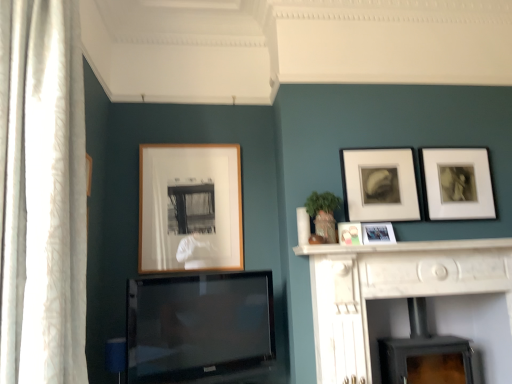
The height and width of the screenshot is (384, 512). What do you see at coordinates (350, 233) in the screenshot? I see `matte plastic picture frame at upper center, the 4th picture frame viewed from the right` at bounding box center [350, 233].

Measure the distance between point (376, 227) and camera.

The depth of point (376, 227) is 2.79 meters.

This screenshot has width=512, height=384. Describe the element at coordinates (378, 233) in the screenshot. I see `metallic silver photo frame at center-right, positioned as the 3th picture frame in left-to-right order` at that location.

Measure the distance between white sheer curtain at left and camera.

4.76 feet.

Identify the location of black matte wood burning stove at lower center. This screenshot has height=384, width=512. (424, 353).

The image size is (512, 384). I want to click on the 1st picture frame in front when counting from the matte black picture frame at upper right, which ranks as the 5th picture frame in left-to-right order, so click(x=379, y=185).

From a real-world perspective, is matte black picture frame at upper right, the second picture frame in the right-to-left sequence, physically below matte black picture frame at upper right, which ranks as the 5th picture frame in left-to-right order?

No, from a real-world perspective, matte black picture frame at upper right, the second picture frame in the right-to-left sequence, is not below matte black picture frame at upper right, which ranks as the 5th picture frame in left-to-right order.

Which is farther from the camera, (394,192) or (449,173)?

The point (449,173) is farther.

Is matte black picture frame at upper right, the second picture frame in the right-to-left sequence, turned away from matte black picture frame at upper right, which ranks as the 5th picture frame in left-to-right order?

No.

How different are the orientations of matte black picture frame at upper right, which is the first picture frame from right to left, and black matte wood burning stove at lower center in degrees?

They differ by 0.748 degrees in their facing directions.

Is black matte wood burning stove at lower center at the back of matte black picture frame at upper right, which ranks as the 5th picture frame in left-to-right order?

matte black picture frame at upper right, which ranks as the 5th picture frame in left-to-right order, does not have its back to black matte wood burning stove at lower center.

Is matte black picture frame at upper right, which ranks as the 5th picture frame in left-to-right order, positioned in front of black matte wood burning stove at lower center?

No, the depth of matte black picture frame at upper right, which ranks as the 5th picture frame in left-to-right order, is greater than that of black matte wood burning stove at lower center.

Is matte black picture frame at upper right, which ranks as the 5th picture frame in left-to-right order, touching black matte wood burning stove at lower center?

They are not placed beside each other.

Could you tell me if flat-screen tv at center is turned towards white sheer curtain at left?

No, flat-screen tv at center is not turned towards white sheer curtain at left.

Which of these two, flat-screen tv at center or white sheer curtain at left, is thinner?

Thinner between the two is flat-screen tv at center.

Between flat-screen tv at center and white sheer curtain at left, which one has smaller size?

flat-screen tv at center.

Which point is more distant from viewer, (236,283) or (62,196)?

The point (236,283) is farther from the camera.

From a real-world perspective, is white marble fireplace at center physically located above or below matte black picture frame at upper right, the second picture frame in the right-to-left sequence?

white marble fireplace at center is situated lower than matte black picture frame at upper right, the second picture frame in the right-to-left sequence, in the real world.

Considering the relative sizes of white marble fireplace at center and matte black picture frame at upper right, placed as the fourth picture frame when sorted from left to right, in the image provided, is white marble fireplace at center smaller than matte black picture frame at upper right, placed as the fourth picture frame when sorted from left to right,?

Actually, white marble fireplace at center might be larger than matte black picture frame at upper right, placed as the fourth picture frame when sorted from left to right.

Is white marble fireplace at center shorter than matte black picture frame at upper right, placed as the fourth picture frame when sorted from left to right?

In fact, white marble fireplace at center may be taller than matte black picture frame at upper right, placed as the fourth picture frame when sorted from left to right.

Is white marble fireplace at center positioned before matte black picture frame at upper right, the second picture frame in the right-to-left sequence?

Yes, white marble fireplace at center is closer to the camera.

Is metallic silver photo frame at center-right, positioned as the 3th picture frame in left-to-right order, further to the viewer compared to matte black picture frame at upper right, which is the first picture frame from right to left?

That is False.

From a real-world perspective, relative to matte black picture frame at upper right, which is the first picture frame from right to left, is metallic silver photo frame at center-right, which appears as the third picture frame when viewed from the right, vertically above or below?

metallic silver photo frame at center-right, which appears as the third picture frame when viewed from the right, is below matte black picture frame at upper right, which is the first picture frame from right to left.

From the image's perspective, is metallic silver photo frame at center-right, positioned as the 3th picture frame in left-to-right order, over matte black picture frame at upper right, which is the first picture frame from right to left?

Incorrect, from the image's perspective, metallic silver photo frame at center-right, positioned as the 3th picture frame in left-to-right order, is lower than matte black picture frame at upper right, which is the first picture frame from right to left.

Is matte black picture frame at upper right, which ranks as the 5th picture frame in left-to-right order, located within metallic silver photo frame at center-right, positioned as the 3th picture frame in left-to-right order?

No, matte black picture frame at upper right, which ranks as the 5th picture frame in left-to-right order, is not a part of metallic silver photo frame at center-right, positioned as the 3th picture frame in left-to-right order.

Can you confirm if white sheer curtain at left is shorter than wooden frame at center, positioned as the fifth picture frame in right-to-left order?

In fact, white sheer curtain at left may be taller than wooden frame at center, positioned as the fifth picture frame in right-to-left order.

From the image's perspective, is white sheer curtain at left on top of wooden frame at center, which appears as the first picture frame when viewed from the left?

Indeed, from the image's perspective, white sheer curtain at left is shown above wooden frame at center, which appears as the first picture frame when viewed from the left.

Considering the relative positions of white sheer curtain at left and wooden frame at center, positioned as the fifth picture frame in right-to-left order, in the image provided, is white sheer curtain at left to the left or to the right of wooden frame at center, positioned as the fifth picture frame in right-to-left order,?

In the image, white sheer curtain at left appears on the left side of wooden frame at center, positioned as the fifth picture frame in right-to-left order.

Does white sheer curtain at left have a lesser width compared to wooden frame at center, positioned as the fifth picture frame in right-to-left order?

Incorrect, the width of white sheer curtain at left is not less than that of wooden frame at center, positioned as the fifth picture frame in right-to-left order.

From a real-world perspective, is flat-screen tv at center positioned under white marble fireplace at center based on gravity?

No, from a real-world perspective, flat-screen tv at center is not below white marble fireplace at center.

How many degrees apart are the facing directions of flat-screen tv at center and white marble fireplace at center?

There is a 23.9-degree angle between the facing directions of flat-screen tv at center and white marble fireplace at center.

Are flat-screen tv at center and white marble fireplace at center located far from each other?

Actually, flat-screen tv at center and white marble fireplace at center are a little close together.

Considering the positions of objects flat-screen tv at center and white marble fireplace at center in the image provided, who is more to the left, flat-screen tv at center or white marble fireplace at center?

flat-screen tv at center.

From a real-world perspective, count 1st picture frames downward from the matte black picture frame at upper right, the second picture frame in the right-to-left sequence, and point to it. Please provide its 2D coordinates.

[(457, 183)]

Image resolution: width=512 pixels, height=384 pixels. What are the coordinates of `wood burning stove below the matte black picture frame at upper right, which ranks as the 5th picture frame in left-to-right order (from the image's perspective)` in the screenshot? It's located at (424, 353).

Estimate the real-world distances between objects in this image. Which object is closer to white marble fireplace at center, black matte wood burning stove at lower center or matte plastic picture frame at upper center, the 4th picture frame viewed from the right?

black matte wood burning stove at lower center is closer to white marble fireplace at center.

Looking at the image, which one is located closer to matte plastic picture frame at upper center, which ranks as the second picture frame in left-to-right order, metallic silver photo frame at center-right, which appears as the third picture frame when viewed from the right, or matte black picture frame at upper right, which ranks as the 5th picture frame in left-to-right order?

The object closer to matte plastic picture frame at upper center, which ranks as the second picture frame in left-to-right order, is metallic silver photo frame at center-right, which appears as the third picture frame when viewed from the right.

Considering their positions, is black matte wood burning stove at lower center positioned closer to matte black picture frame at upper right, which is the first picture frame from right to left, than wooden frame at center, which appears as the first picture frame when viewed from the left?

black matte wood burning stove at lower center lies closer to matte black picture frame at upper right, which is the first picture frame from right to left, than the other object.

From the image, which object appears to be nearer to metallic silver photo frame at center-right, which appears as the third picture frame when viewed from the right, white marble fireplace at center or wooden frame at center, which appears as the first picture frame when viewed from the left?

white marble fireplace at center is closer to metallic silver photo frame at center-right, which appears as the third picture frame when viewed from the right.

Looking at the image, which one is located further to black matte wood burning stove at lower center, matte black picture frame at upper right, which is the first picture frame from right to left, or white sheer curtain at left?

Based on the image, white sheer curtain at left appears to be further to black matte wood burning stove at lower center.

Based on their spatial positions, is matte black picture frame at upper right, which ranks as the 5th picture frame in left-to-right order, or wooden frame at center, which appears as the first picture frame when viewed from the left, further from white marble fireplace at center?

Among the two, wooden frame at center, which appears as the first picture frame when viewed from the left, is located further to white marble fireplace at center.

Estimate the real-world distances between objects in this image. Which object is closer to matte black picture frame at upper right, which is the first picture frame from right to left, wooden frame at center, which appears as the first picture frame when viewed from the left, or matte plastic picture frame at upper center, which ranks as the second picture frame in left-to-right order?

The object closer to matte black picture frame at upper right, which is the first picture frame from right to left, is matte plastic picture frame at upper center, which ranks as the second picture frame in left-to-right order.

Considering their positions, is white marble fireplace at center positioned closer to flat-screen tv at center than wooden frame at center, positioned as the fifth picture frame in right-to-left order?

wooden frame at center, positioned as the fifth picture frame in right-to-left order.

I want to click on fireplace that lies between matte black picture frame at upper right, placed as the fourth picture frame when sorted from left to right, and black matte wood burning stove at lower center from top to bottom, so click(x=392, y=290).

Locate an element on the screen. The height and width of the screenshot is (384, 512). wood burning stove located between flat-screen tv at center and matte black picture frame at upper right, which is the first picture frame from right to left, in the left-right direction is located at coordinates (424, 353).

The image size is (512, 384). Identify the location of picture frame that lies between matte plastic picture frame at upper center, which ranks as the second picture frame in left-to-right order, and black matte wood burning stove at lower center from top to bottom. (378, 233).

Where is `wood burning stove between flat-screen tv at center and white marble fireplace at center in the horizontal direction`? Image resolution: width=512 pixels, height=384 pixels. wood burning stove between flat-screen tv at center and white marble fireplace at center in the horizontal direction is located at coordinates (424, 353).